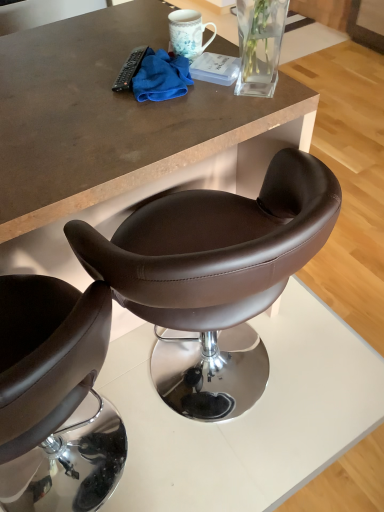
Find the location of a particular element. free space underneath brown leather chair at center (from a real-world perspective) is located at coordinates (232, 388).